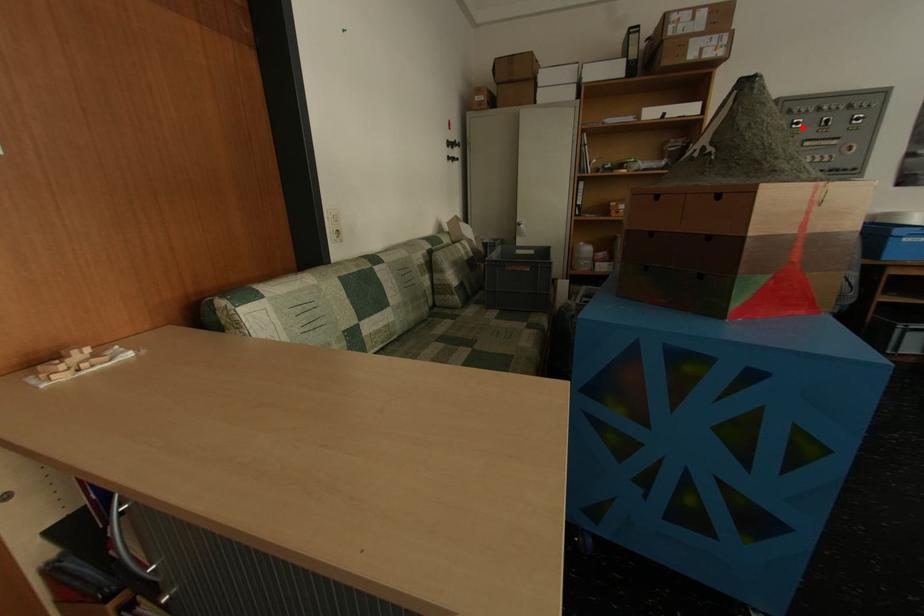
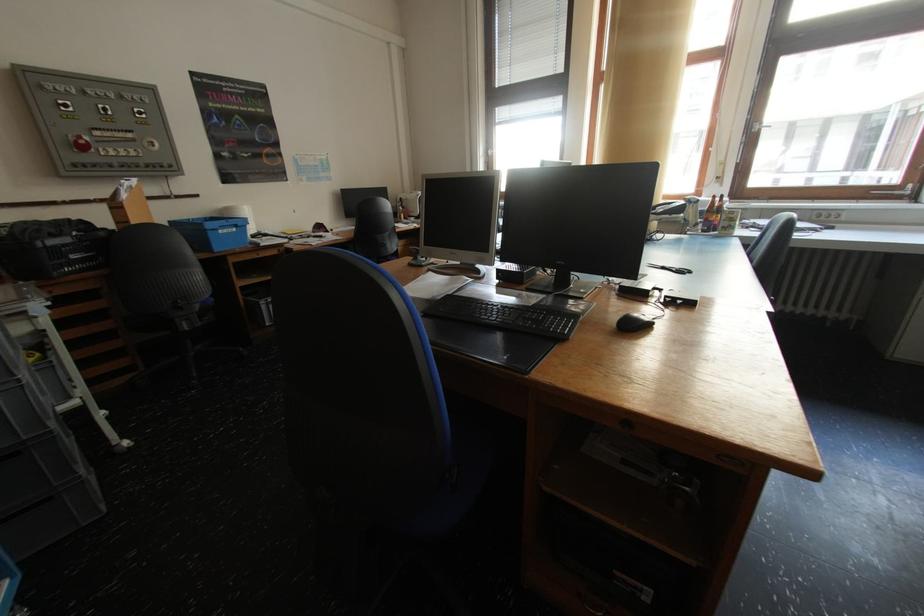
Question: I am providing you with two images of the same scene from different viewpoints. A red point is shown in image1. For the corresponding object point in image2, is it positioned nearer or farther from the camera?

Choices:
 (A) Nearer
 (B) Farther

Answer: (B)